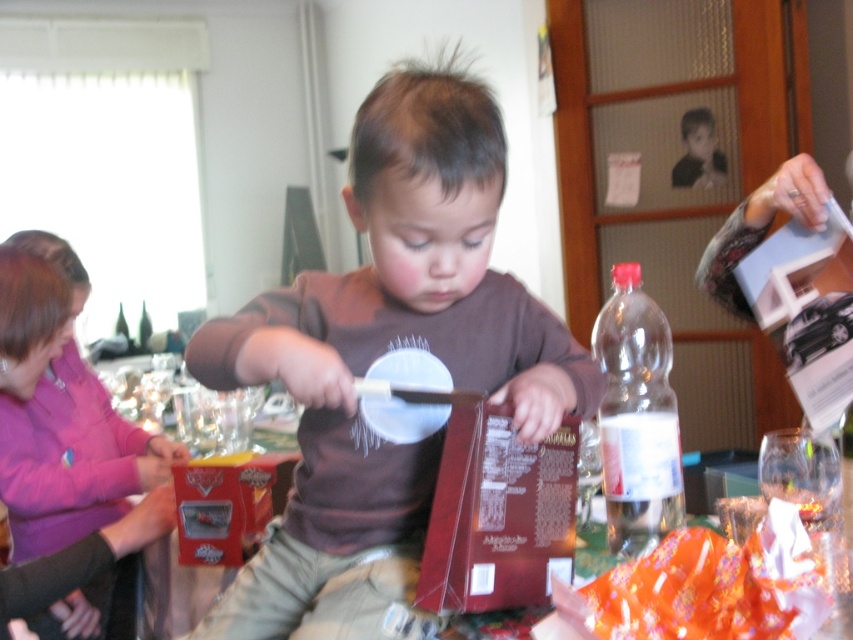
Question: Estimate the real-world distances between objects in this image. Which object is closer to the brown matte shirt at center?

Choices:
 (A) transparent plastic bottle at left
 (B) clear plastic bottle at right
 (C) clear plastic bottle at center
 (D) transparent plastic bottle at center

Answer: (B)

Question: Which object is the closest to the transparent plastic bottle at center?

Choices:
 (A) clear plastic bottle at center
 (B) brown matte shirt at center

Answer: (B)

Question: Is brown matte shirt at center bigger than clear plastic bottle at center?

Choices:
 (A) yes
 (B) no

Answer: (A)

Question: Is clear plastic bottle at right to the right of transparent plastic bottle at center from the viewer's perspective?

Choices:
 (A) no
 (B) yes

Answer: (B)

Question: Considering the real-world distances, which object is farthest from the clear plastic bottle at right?

Choices:
 (A) clear plastic bottle at center
 (B) transparent plastic bottle at center

Answer: (B)

Question: Does brown matte shirt at center come in front of clear plastic bottle at right?

Choices:
 (A) yes
 (B) no

Answer: (A)